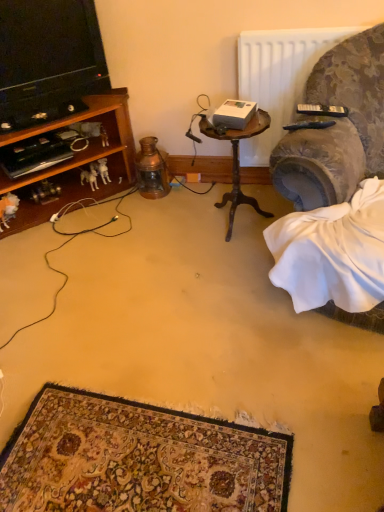
Where is `empty space that is ontop of wooden table at center (from a real-world perspective)`? This screenshot has height=512, width=384. empty space that is ontop of wooden table at center (from a real-world perspective) is located at coordinates (238, 129).